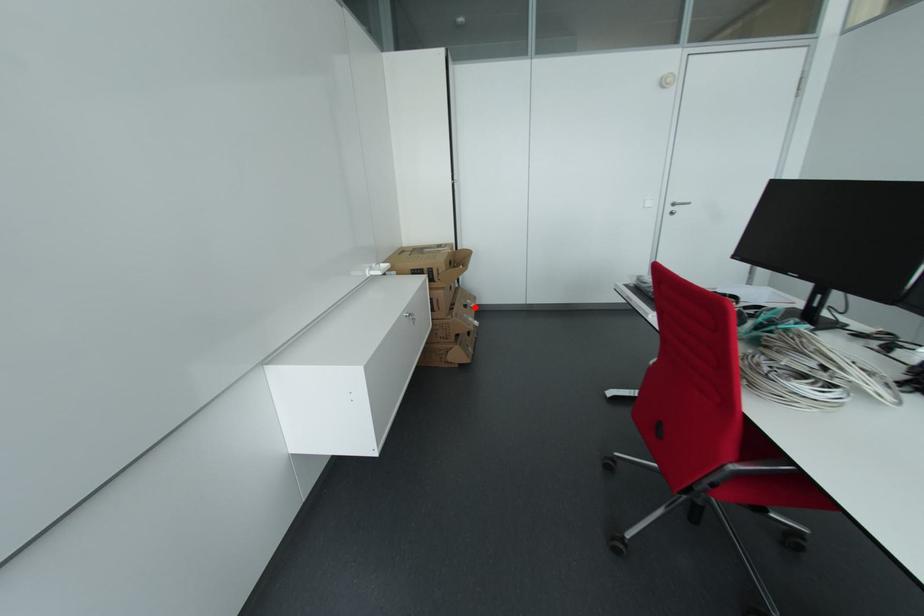
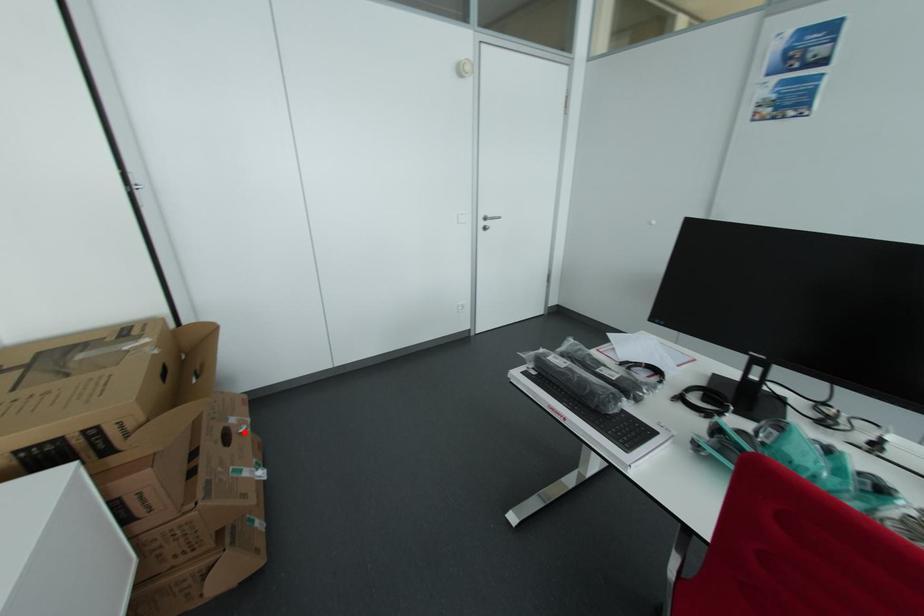
I am providing you with two images of the same scene from different viewpoints. A red point is marked on the first image and another point is marked on the second image. Is the marked point in image1 the same physical position as the marked point in image2?

Yes